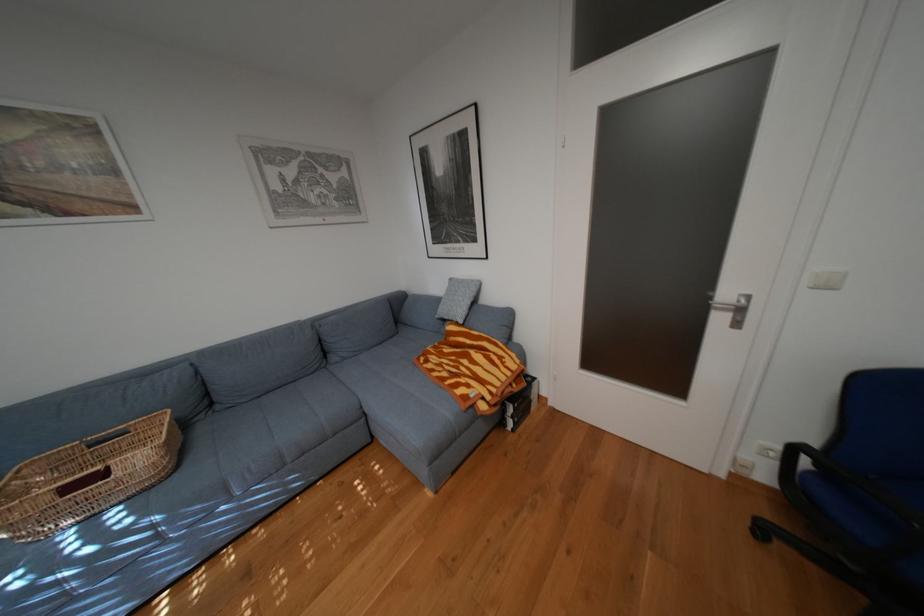
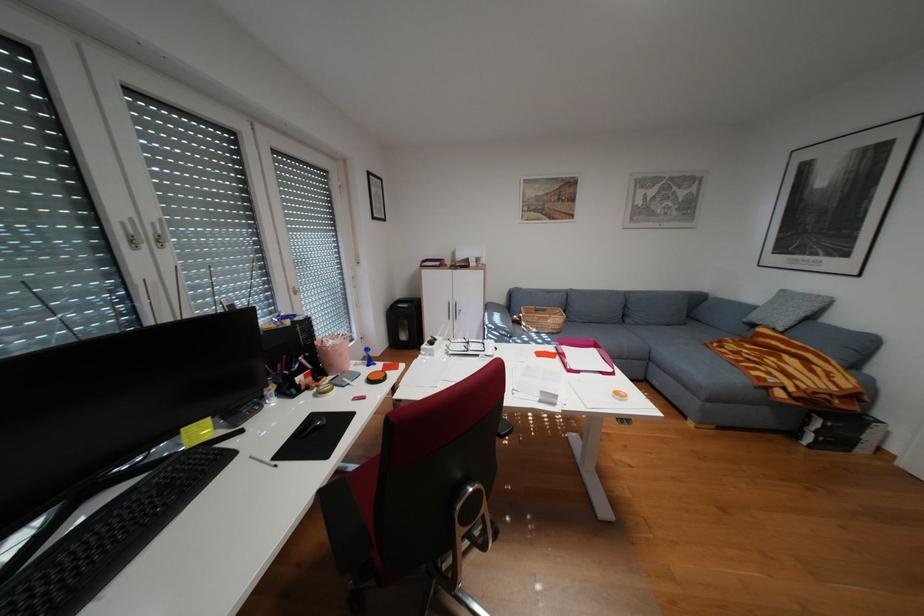
Find the pixel in the second image that matches [480,386] in the first image.

(782, 373)